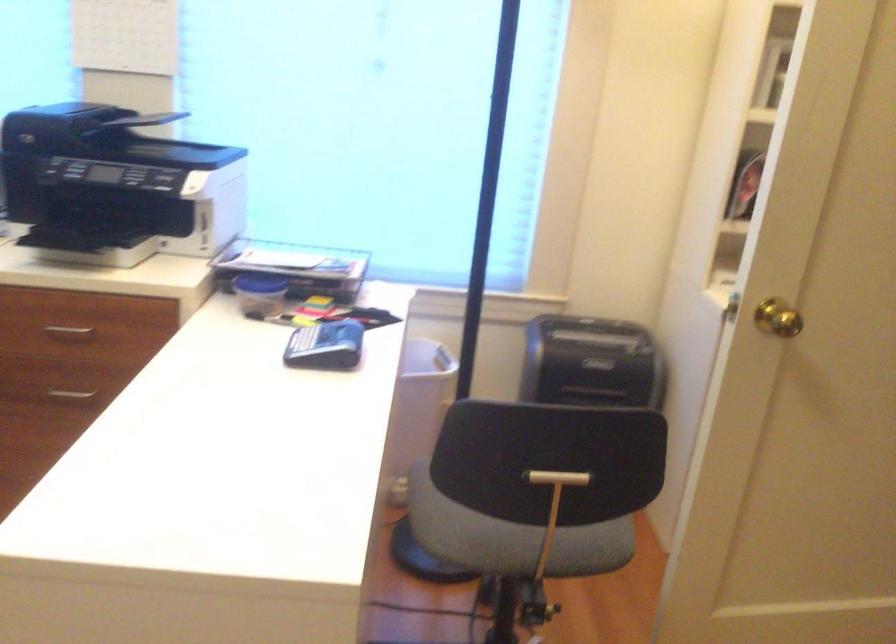
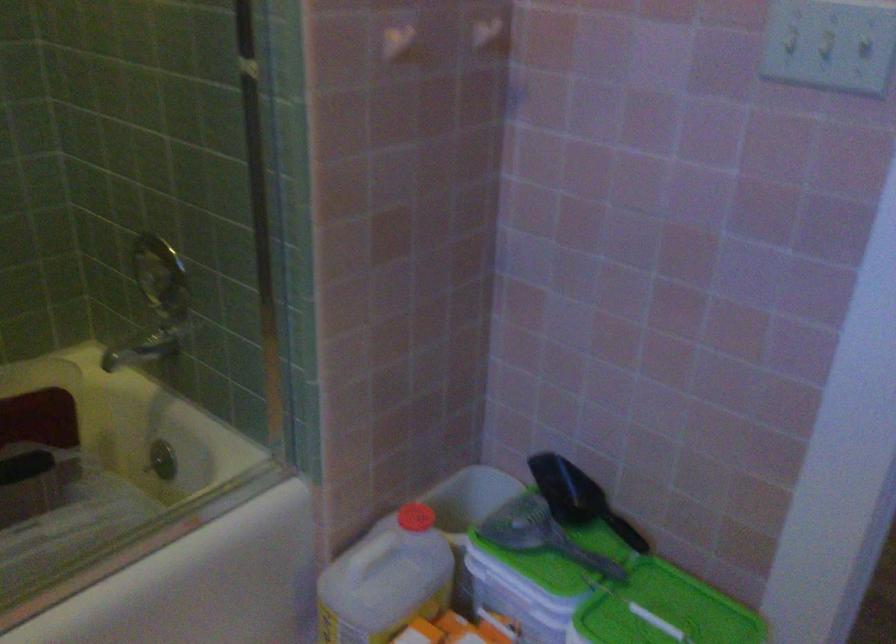
Question: I am providing you with two images of the same scene from different viewpoints. Which of the following objects are not visible in image2?

Choices:
 (A) white plastic jug
 (B) shower faucet handle
 (C) white security camera
 (D) black paper shredder

Answer: (D)